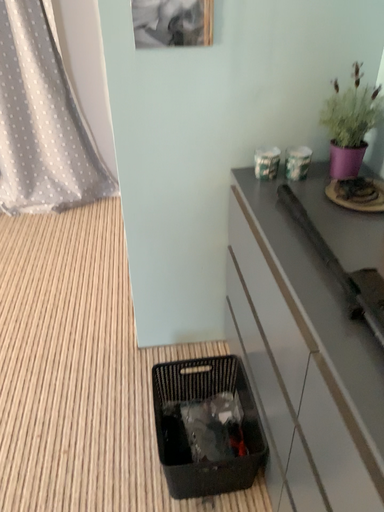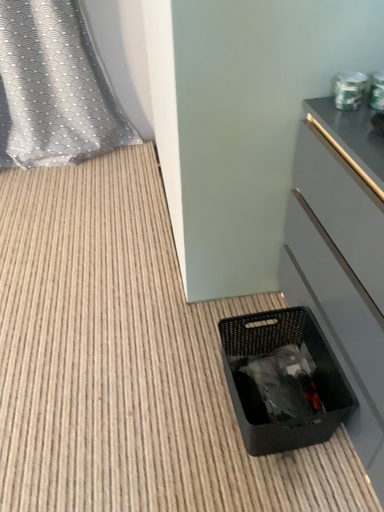
Question: Which way did the camera rotate in the video?

Choices:
 (A) rotated downward
 (B) rotated upward

Answer: (A)